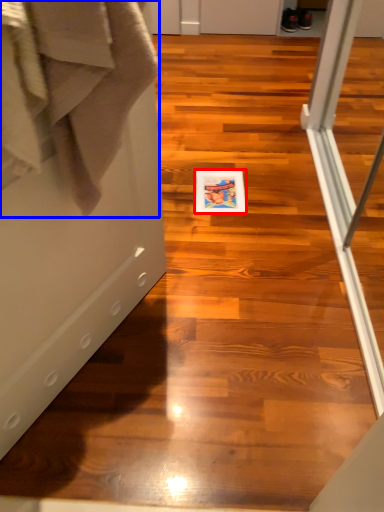
Question: Which object appears farthest to the camera in this image, postcard (highlighted by a red box) or bath towel (highlighted by a blue box)?

Choices:
 (A) postcard
 (B) bath towel

Answer: (A)